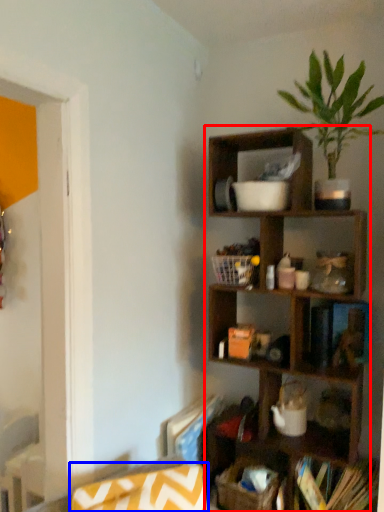
Question: Among these objects, which one is nearest to the camera, shelf (highlighted by a red box) or swivel chair (highlighted by a blue box)?

Choices:
 (A) shelf
 (B) swivel chair

Answer: (B)